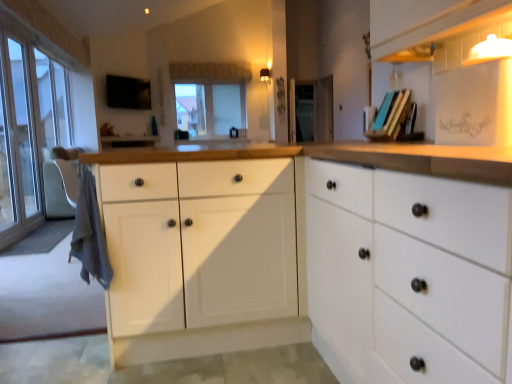
Question: From the image's perspective, does transparent glass screen door at center appear lower than metallic black knob at center, which is the third knob from bottom to top?

Choices:
 (A) no
 (B) yes

Answer: (B)

Question: Is transparent glass screen door at center positioned in front of metallic black knob at center, which is the third knob from bottom to top?

Choices:
 (A) yes
 (B) no

Answer: (B)

Question: Does transparent glass screen door at center contain metallic black knob at center, which is the first knob in top-to-bottom order?

Choices:
 (A) no
 (B) yes

Answer: (A)

Question: Considering the relative positions of transparent glass screen door at center and metallic black knob at center, which is the third knob from bottom to top, in the image provided, is transparent glass screen door at center to the right of metallic black knob at center, which is the third knob from bottom to top, from the viewer's perspective?

Choices:
 (A) no
 (B) yes

Answer: (B)

Question: From the image's perspective, is transparent glass screen door at center located above metallic black knob at center, which is the third knob from bottom to top?

Choices:
 (A) yes
 (B) no

Answer: (B)

Question: Considering the positions of metallic knob at center, the 2th knob ordered from the bottom, and matte blue book at upper right in the image, is metallic knob at center, the 2th knob ordered from the bottom, taller or shorter than matte blue book at upper right?

Choices:
 (A) tall
 (B) short

Answer: (B)

Question: In terms of size, does metallic knob at center, the 2th knob ordered from the bottom, appear bigger or smaller than matte blue book at upper right?

Choices:
 (A) small
 (B) big

Answer: (A)

Question: From the image's perspective, is metallic knob at center, the 2th knob ordered from the bottom, located above or below matte blue book at upper right?

Choices:
 (A) above
 (B) below

Answer: (A)

Question: From a real-world perspective, is metallic knob at center, which is the second knob from top to bottom, physically located above or below matte blue book at upper right?

Choices:
 (A) below
 (B) above

Answer: (B)

Question: Is transparent glass window at center wider or thinner than matte black knob at center, which is the 1th knob from bottom to top?

Choices:
 (A) thin
 (B) wide

Answer: (B)

Question: Based on their sizes in the image, would you say transparent glass window at center is bigger or smaller than matte black knob at center, which is counted as the third knob, starting from the top?

Choices:
 (A) small
 (B) big

Answer: (B)

Question: Considering the relative positions of transparent glass window at center and matte black knob at center, which is the 1th knob from bottom to top, in the image provided, is transparent glass window at center to the left or to the right of matte black knob at center, which is the 1th knob from bottom to top,?

Choices:
 (A) left
 (B) right

Answer: (A)

Question: Is transparent glass window at center in front of or behind matte black knob at center, which is counted as the third knob, starting from the top, in the image?

Choices:
 (A) behind
 (B) front

Answer: (A)

Question: Is point (495, 31) positioned closer to the camera than point (309, 125)?

Choices:
 (A) closer
 (B) farther

Answer: (A)

Question: Considering the positions of matte white shelf at upper right and transparent glass screen door at center in the image, is matte white shelf at upper right bigger or smaller than transparent glass screen door at center?

Choices:
 (A) big
 (B) small

Answer: (B)